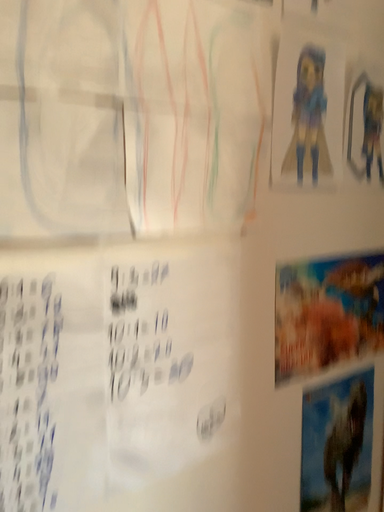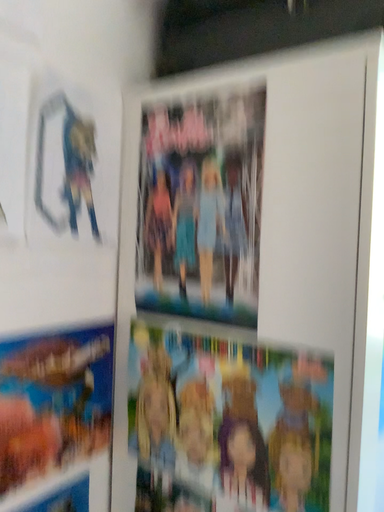
Question: Which way did the camera rotate in the video?

Choices:
 (A) rotated right
 (B) rotated left

Answer: (A)